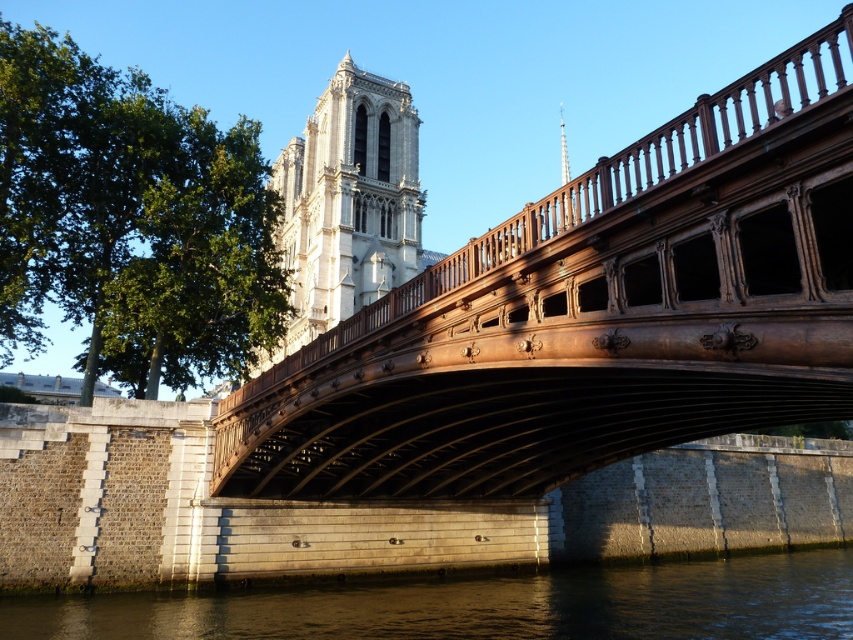
You are standing on the historic bridge and looking towards the cathedral. You notice the dark gray water at lower center and the smooth silver spire at upper center. Which object is positioned higher from your viewpoint?

The smooth silver spire at upper center is positioned higher than the dark gray water at lower center from your viewpoint.

You are standing at the historic bridge and want to take a photo of the cathedral. You notice two points marked on your camera screen at coordinates point (x=764, y=106) and point (x=569, y=196). Which point is closer to you when looking through the camera?

Point (x=764, y=106) is closer to the viewer than point (x=569, y=196).